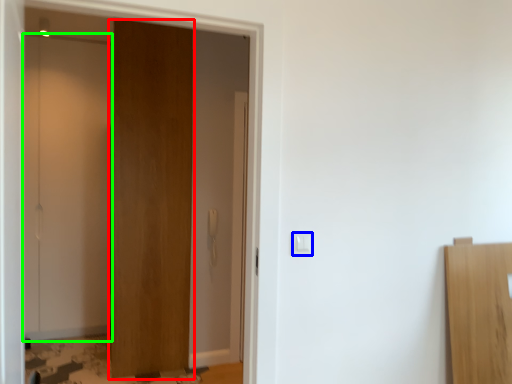
Question: Which object is the closest to the door (highlighted by a red box)? Choose among these: light switch (highlighted by a blue box) or door (highlighted by a green box).

Choices:
 (A) light switch
 (B) door

Answer: (B)